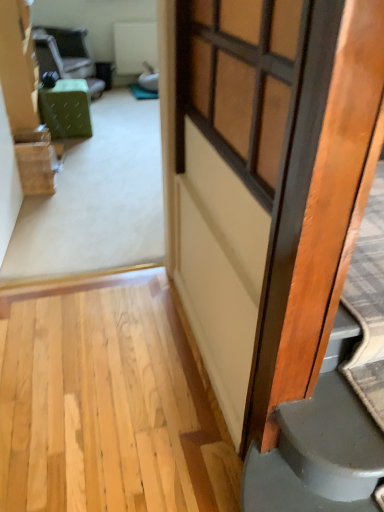
Question: From a real-world perspective, is wooden door at right over green fabric ottoman at center?

Choices:
 (A) no
 (B) yes

Answer: (B)

Question: Is wooden door at right not near green fabric ottoman at center?

Choices:
 (A) no
 (B) yes

Answer: (B)

Question: Considering the relative sizes of wooden door at right and green fabric ottoman at center in the image provided, is wooden door at right taller than green fabric ottoman at center?

Choices:
 (A) no
 (B) yes

Answer: (A)

Question: Does wooden door at right have a larger size compared to green fabric ottoman at center?

Choices:
 (A) yes
 (B) no

Answer: (A)

Question: From a real-world perspective, is wooden door at right located beneath green fabric ottoman at center?

Choices:
 (A) no
 (B) yes

Answer: (A)

Question: From the image's perspective, is wooden door at right below green fabric ottoman at center?

Choices:
 (A) yes
 (B) no

Answer: (A)

Question: Is green fabric chair at upper left in contact with wooden door at right?

Choices:
 (A) no
 (B) yes

Answer: (A)

Question: Can you confirm if green fabric chair at upper left is thinner than wooden door at right?

Choices:
 (A) yes
 (B) no

Answer: (B)

Question: From the image's perspective, is green fabric chair at upper left located above wooden door at right?

Choices:
 (A) no
 (B) yes

Answer: (B)

Question: Considering the relative sizes of green fabric chair at upper left and wooden door at right in the image provided, is green fabric chair at upper left bigger than wooden door at right?

Choices:
 (A) no
 (B) yes

Answer: (B)

Question: Is green fabric chair at upper left to the right of wooden door at right from the viewer's perspective?

Choices:
 (A) yes
 (B) no

Answer: (B)

Question: Could you tell me if green fabric chair at upper left is turned towards wooden door at right?

Choices:
 (A) no
 (B) yes

Answer: (A)

Question: Can you confirm if matte wooden window at center is positioned to the right of wooden door at right?

Choices:
 (A) yes
 (B) no

Answer: (B)